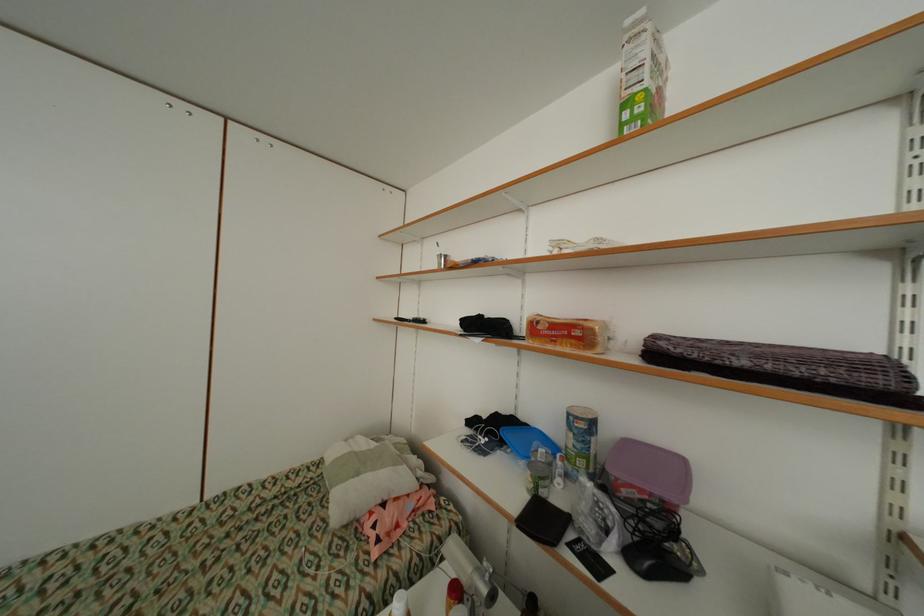
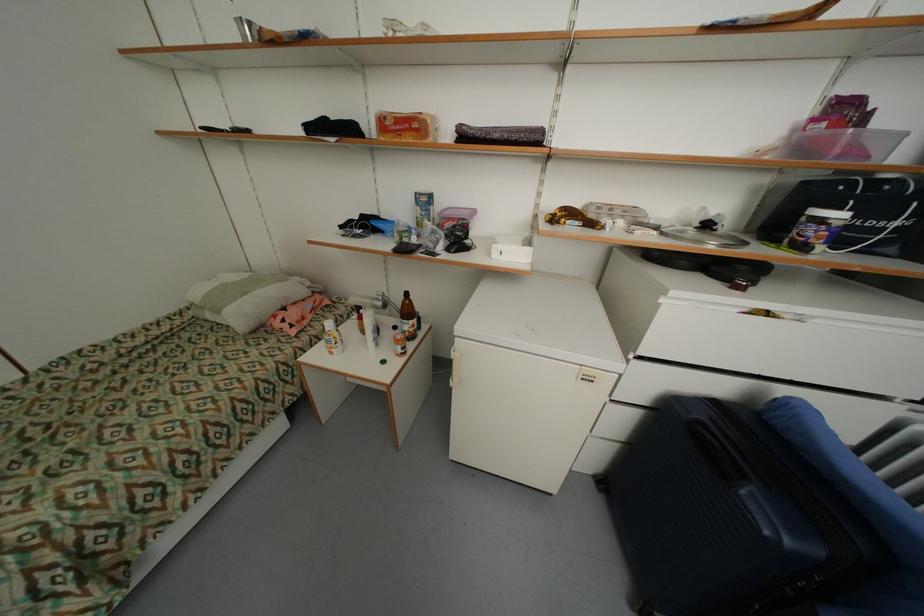
The point at (422, 535) is marked in the first image. Where is the corresponding point in the second image?

(327, 320)